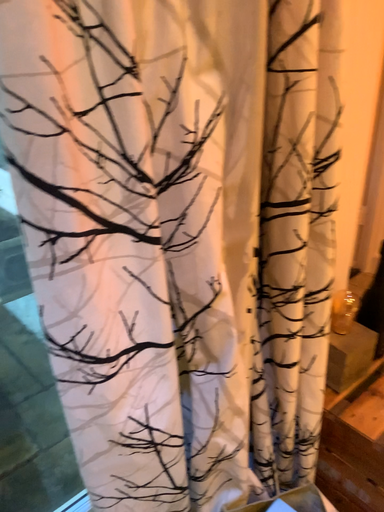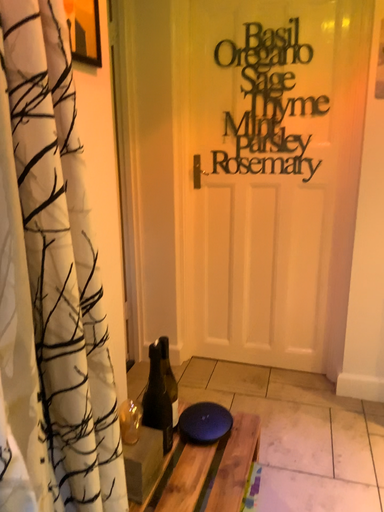
Question: Which way did the camera rotate in the video?

Choices:
 (A) rotated left
 (B) rotated right

Answer: (B)